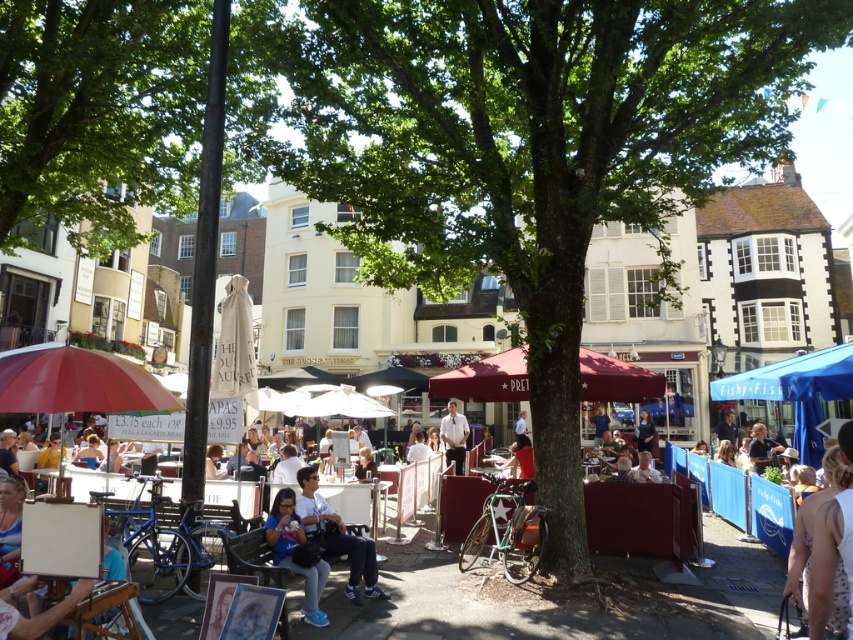
Question: Which point is farther to the camera?

Choices:
 (A) blue denim jeans at center
 (B) green leafy tree at center
 (C) matte red umbrella at lower left

Answer: (B)

Question: Among these points, which one is nearest to the camera?

Choices:
 (A) (325, 570)
 (B) (148, 396)

Answer: (B)

Question: Does white fabric umbrella at center have a greater width compared to dark brown hair at center?

Choices:
 (A) no
 (B) yes

Answer: (B)

Question: Can you confirm if white floral dress at lower right is smaller than blue denim jeans at center?

Choices:
 (A) yes
 (B) no

Answer: (B)

Question: Which point is farther to the camera?

Choices:
 (A) white floral dress at lower right
 (B) blue fabric canopy at right
 (C) white fabric umbrella at center

Answer: (B)

Question: Is light blue jeans at center thinner than dark brown hair at center?

Choices:
 (A) yes
 (B) no

Answer: (B)